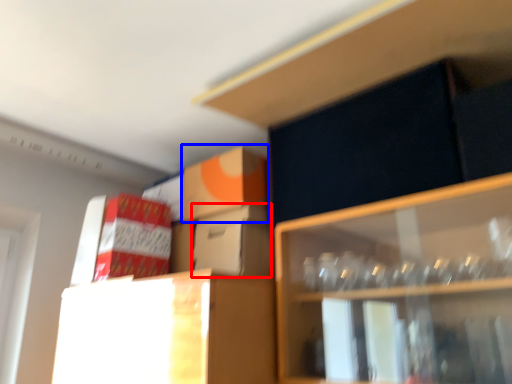
Question: Which object appears closest to the camera in this image, cardboard box (highlighted by a red box) or cardboard box (highlighted by a blue box)?

Choices:
 (A) cardboard box
 (B) cardboard box

Answer: (A)